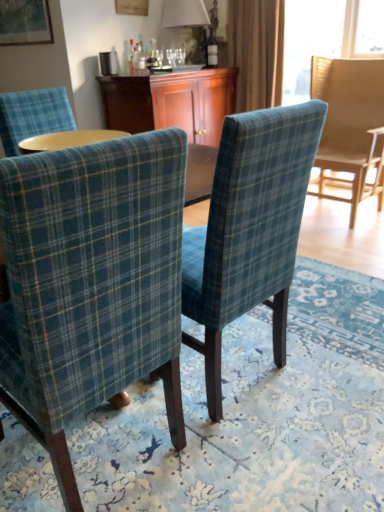
Describe the element at coordinates (256, 51) in the screenshot. I see `velvet curtain at upper center` at that location.

You are a GUI agent. You are given a task and a screenshot of the screen. Output one action in this format:
    pyautogui.click(x=<x>, y=<y>)
    Task: Click on the velvet curtain at upper center
    
    Given the screenshot: What is the action you would take?
    pyautogui.click(x=256, y=51)

In order to face matte white lampshade at upper center, should I rotate leftwards or rightwards?

To align with it, rotate left about 0.663°.

The image size is (384, 512). What do you see at coordinates (350, 125) in the screenshot? I see `teal plaid chair at right, arranged as the 3th chair when viewed from the left` at bounding box center [350, 125].

Locate an element on the screen. This screenshot has height=512, width=384. velvet curtain at upper center is located at coordinates (256, 51).

Is blue plaid fabric chair at center, the 2th chair in the back-to-front sequence, taller or shorter than plaid fabric chair at center, the 3th chair when ordered from right to left?

Considering their sizes, blue plaid fabric chair at center, the 2th chair in the back-to-front sequence, has less height than plaid fabric chair at center, the 3th chair when ordered from right to left.

Is blue plaid fabric chair at center, which is counted as the second chair, starting from the front, facing towards plaid fabric chair at center, the first chair positioned from the left?

No, blue plaid fabric chair at center, which is counted as the second chair, starting from the front, does not turn towards plaid fabric chair at center, the first chair positioned from the left.

Is blue plaid fabric chair at center, which is counted as the second chair, starting from the left, far away from plaid fabric chair at center, placed as the 3th chair when sorted from back to front?

No, there isn't a large distance between blue plaid fabric chair at center, which is counted as the second chair, starting from the left, and plaid fabric chair at center, placed as the 3th chair when sorted from back to front.

Does matte white lampshade at upper center have a lesser width compared to teal plaid chair at right, which is counted as the third chair, starting from the front?

Indeed, matte white lampshade at upper center has a lesser width compared to teal plaid chair at right, which is counted as the third chair, starting from the front.

Which is more to the right, matte white lampshade at upper center or teal plaid chair at right, arranged as the 3th chair when viewed from the left?

teal plaid chair at right, arranged as the 3th chair when viewed from the left, is more to the right.

In terms of height, does matte white lampshade at upper center look taller or shorter compared to teal plaid chair at right, which is counted as the third chair, starting from the front?

Clearly, matte white lampshade at upper center is shorter compared to teal plaid chair at right, which is counted as the third chair, starting from the front.

At what (x,y) coordinates should I click in order to perform the action: click on the 1st chair below the matte white lampshade at upper center (from the image's perspective). Please return your answer as a coordinate pair (x, y). Looking at the image, I should click on (350, 125).

Is wooden cabinet at center bigger or smaller than velvet curtain at upper center?

wooden cabinet at center is bigger than velvet curtain at upper center.

Is wooden cabinet at center not close to velvet curtain at upper center?

No, wooden cabinet at center is in close proximity to velvet curtain at upper center.

From the image's perspective, which one is positioned higher, wooden cabinet at center or velvet curtain at upper center?

velvet curtain at upper center, from the image's perspective.

Measure the distance from wooden cabinet at center to velvet curtain at upper center.

A distance of 18.28 inches exists between wooden cabinet at center and velvet curtain at upper center.

Based on the photo, in terms of width, does teal plaid chair at right, the first chair when ordered from right to left, look wider or thinner when compared to wooden cabinet at center?

Clearly, teal plaid chair at right, the first chair when ordered from right to left, has less width compared to wooden cabinet at center.

Based on the photo, how distant is teal plaid chair at right, which ranks as the first chair in back-to-front order, from wooden cabinet at center?

teal plaid chair at right, which ranks as the first chair in back-to-front order, and wooden cabinet at center are 3.38 feet apart from each other.

Who is taller, teal plaid chair at right, which is counted as the third chair, starting from the front, or wooden cabinet at center?

With more height is teal plaid chair at right, which is counted as the third chair, starting from the front.

Which object is positioned more to the left, teal plaid chair at right, arranged as the 3th chair when viewed from the left, or wooden cabinet at center?

wooden cabinet at center is more to the left.

Is plaid fabric chair at center, the first chair positioned from the front, spatially inside wooden cabinet at center, or outside of it?

plaid fabric chair at center, the first chair positioned from the front, is not enclosed by wooden cabinet at center.

Is plaid fabric chair at center, the first chair positioned from the left, aimed at wooden cabinet at center?

No, plaid fabric chair at center, the first chair positioned from the left, is not turned towards wooden cabinet at center.

Are plaid fabric chair at center, the first chair positioned from the left, and wooden cabinet at center far apart?

Absolutely, plaid fabric chair at center, the first chair positioned from the left, is distant from wooden cabinet at center.

From a real-world perspective, count 3rd chairs downward from the wooden cabinet at center and point to it. Please provide its 2D coordinates.

[(91, 283)]

Is velvet curtain at upper center smaller than blue plaid fabric chair at center, the 2th chair in the back-to-front sequence?

Yes, velvet curtain at upper center is smaller than blue plaid fabric chair at center, the 2th chair in the back-to-front sequence.

Is point (261, 56) closer or farther from the camera than point (252, 125)?

Point (261, 56) appears to be farther away from the viewer than point (252, 125).

Between velvet curtain at upper center and blue plaid fabric chair at center, which is counted as the second chair, starting from the right, which one is positioned in front?

blue plaid fabric chair at center, which is counted as the second chair, starting from the right, is in front.

Is velvet curtain at upper center not near blue plaid fabric chair at center, the 2th chair in the back-to-front sequence?

Indeed, velvet curtain at upper center is not near blue plaid fabric chair at center, the 2th chair in the back-to-front sequence.

Between velvet curtain at upper center and wooden cabinet at center, which one appears on the right side from the viewer's perspective?

velvet curtain at upper center is more to the right.

Is velvet curtain at upper center not near wooden cabinet at center?

No.

Measure the distance from velvet curtain at upper center to wooden cabinet at center.

A distance of 18.28 inches exists between velvet curtain at upper center and wooden cabinet at center.

From a real-world perspective, relative to wooden cabinet at center, is velvet curtain at upper center vertically above or below?

velvet curtain at upper center is above wooden cabinet at center.

Which chair is the 1st one when counting from the right side of the plaid fabric chair at center, the 3th chair when ordered from right to left? Please provide its 2D coordinates.

[(249, 229)]

Locate an element on the screen. The height and width of the screenshot is (512, 384). the 1st chair positioned below the matte white lampshade at upper center (from the image's perspective) is located at coordinates (350, 125).

Estimate the real-world distances between objects in this image. Which object is further from plaid fabric chair at center, the first chair positioned from the left, velvet curtain at upper center or blue plaid fabric chair at center, which is counted as the second chair, starting from the front?

velvet curtain at upper center lies further to plaid fabric chair at center, the first chair positioned from the left, than the other object.

Which object lies nearer to the anchor point blue plaid fabric chair at center, which is counted as the second chair, starting from the right, wooden cabinet at center or teal plaid chair at right, which ranks as the first chair in back-to-front order?

teal plaid chair at right, which ranks as the first chair in back-to-front order, is closer to blue plaid fabric chair at center, which is counted as the second chair, starting from the right.

From the image, which object appears to be farther from matte white lampshade at upper center, teal plaid chair at right, which is counted as the third chair, starting from the front, or velvet curtain at upper center?

teal plaid chair at right, which is counted as the third chair, starting from the front.

When comparing their distances from velvet curtain at upper center, does wooden cabinet at center or teal plaid chair at right, the first chair when ordered from right to left, seem closer?

wooden cabinet at center lies closer to velvet curtain at upper center than the other object.

Estimate the real-world distances between objects in this image. Which object is closer to teal plaid chair at right, the first chair when ordered from right to left, wooden cabinet at center or blue plaid fabric chair at center, the 2th chair in the back-to-front sequence?

Among the two, wooden cabinet at center is located nearer to teal plaid chair at right, the first chair when ordered from right to left.

When comparing their distances from velvet curtain at upper center, does wooden cabinet at center or blue plaid fabric chair at center, which is counted as the second chair, starting from the right, seem further?

blue plaid fabric chair at center, which is counted as the second chair, starting from the right, is further to velvet curtain at upper center.

When comparing their distances from matte white lampshade at upper center, does blue plaid fabric chair at center, which is counted as the second chair, starting from the right, or plaid fabric chair at center, placed as the 3th chair when sorted from back to front, seem further?

plaid fabric chair at center, placed as the 3th chair when sorted from back to front.

Based on their spatial positions, is matte white lampshade at upper center or wooden cabinet at center closer to teal plaid chair at right, which is counted as the third chair, starting from the front?

wooden cabinet at center lies closer to teal plaid chair at right, which is counted as the third chair, starting from the front, than the other object.

Identify the location of chair between blue plaid fabric chair at center, which is counted as the second chair, starting from the right, and wooden cabinet at center, along the z-axis. (350, 125).

Where is `desk between blue plaid fabric chair at center, which is counted as the second chair, starting from the right, and matte white lampshade at upper center in the front-back direction`? This screenshot has height=512, width=384. desk between blue plaid fabric chair at center, which is counted as the second chair, starting from the right, and matte white lampshade at upper center in the front-back direction is located at coordinates (171, 102).

The image size is (384, 512). I want to click on curtain positioned between plaid fabric chair at center, the 3th chair when ordered from right to left, and matte white lampshade at upper center from near to far, so click(256, 51).

This screenshot has width=384, height=512. I want to click on chair located between plaid fabric chair at center, placed as the 3th chair when sorted from back to front, and teal plaid chair at right, which ranks as the first chair in back-to-front order, in the depth direction, so click(x=249, y=229).